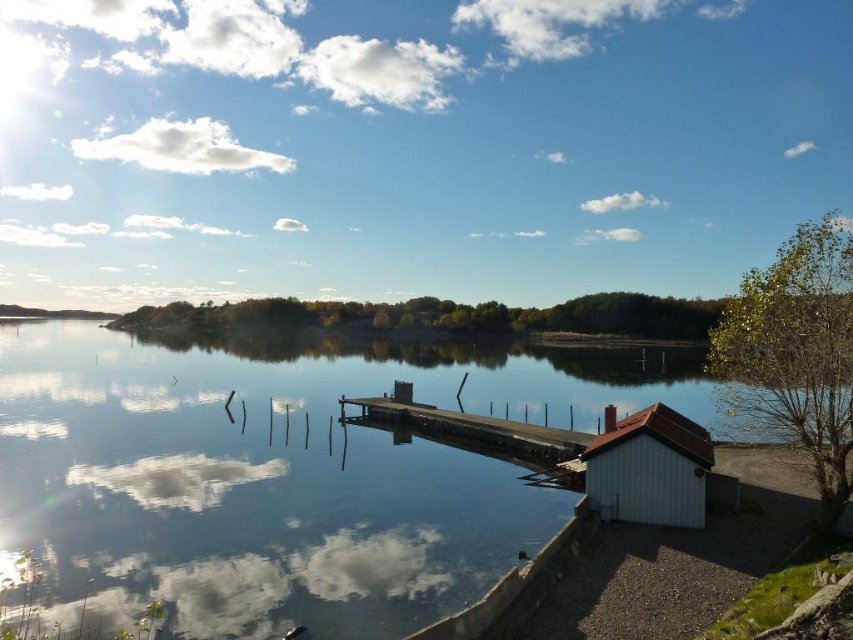
Question: Is white wood hut at lower right to the left of wooden dock at center from the viewer's perspective?

Choices:
 (A) yes
 (B) no

Answer: (B)

Question: Can you confirm if white wood hut at lower right is wider than wooden dock at center?

Choices:
 (A) yes
 (B) no

Answer: (B)

Question: Which of the following is the farthest from the observer?

Choices:
 (A) white wood hut at lower right
 (B) transparent glass water at center
 (C) wooden dock at center

Answer: (C)

Question: Considering the real-world distances, which object is closest to the white wood hut at lower right?

Choices:
 (A) wooden dock at center
 (B) transparent glass water at center

Answer: (A)

Question: Considering the relative positions of white wood hut at lower right and wooden dock at center in the image provided, where is white wood hut at lower right located with respect to wooden dock at center?

Choices:
 (A) above
 (B) below

Answer: (A)

Question: Estimate the real-world distances between objects in this image. Which object is farther from the transparent glass water at center?

Choices:
 (A) wooden dock at center
 (B) white wood hut at lower right

Answer: (B)